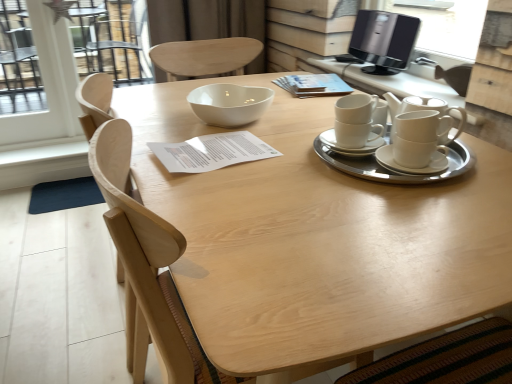
The image size is (512, 384). What are the coordinates of `vacant space underneath black glossy computer monitor at upper right (from a real-world perspective)` in the screenshot? It's located at (378, 73).